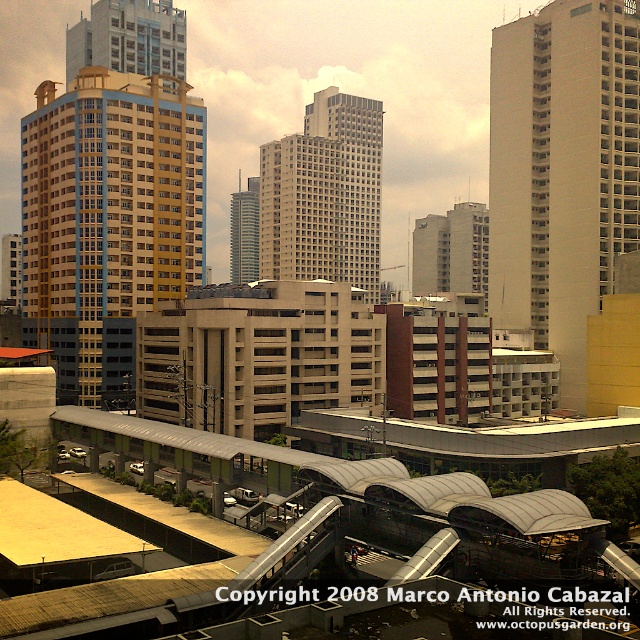
Which is in front, point (90, 268) or point (340, 113)?

Positioned in front is point (90, 268).

Measure the distance between yellow matte building at center and camera.

yellow matte building at center and camera are 137.09 meters apart.

Where is `yellow matte building at center`? The image size is (640, 640). yellow matte building at center is located at coordinates (108, 209).

Who is taller, white concrete building at center or white glass building at center?

Standing taller between the two is white concrete building at center.

Can you confirm if white concrete building at center is wider than white glass building at center?

Incorrect, white concrete building at center's width does not surpass white glass building at center's.

In order to click on white concrete building at center in this screenshot , I will do `click(563, 170)`.

Locate an element on the screen. white concrete building at center is located at coordinates (563, 170).

Which is above, yellow matte building at center or smooth glass skyscraper at center?

Positioned higher is smooth glass skyscraper at center.

At what (x,y) coordinates should I click in order to perform the action: click on yellow matte building at center. Please return your answer as a coordinate pair (x, y). Looking at the image, I should click on (108, 209).

Between point (97, 140) and point (240, 237), which one is positioned in front?

Positioned in front is point (97, 140).

This screenshot has width=640, height=640. Find the location of `yellow matte building at center`. yellow matte building at center is located at coordinates (108, 209).